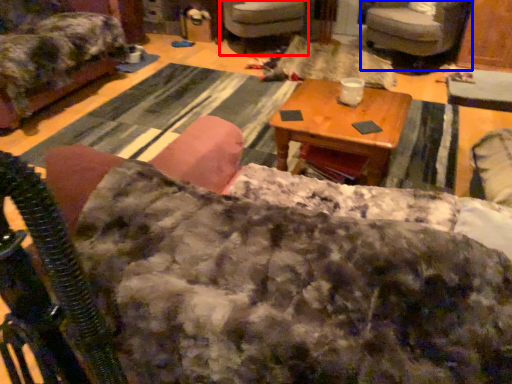
Question: Which object appears closest to the camera in this image, chair (highlighted by a red box) or chair (highlighted by a blue box)?

Choices:
 (A) chair
 (B) chair

Answer: (B)